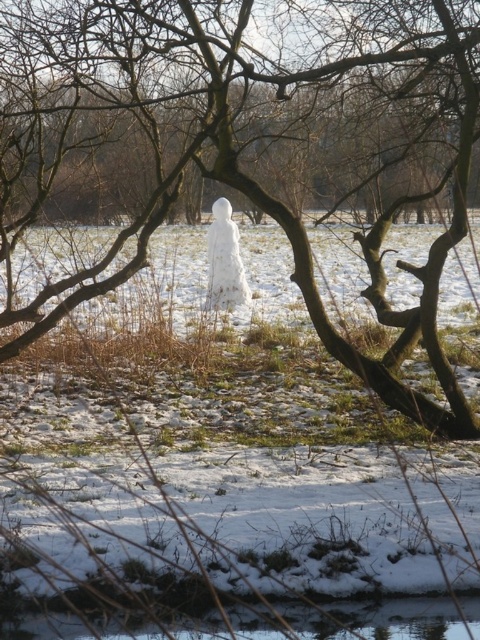
You are standing in the winter scene and see both the white snowman at center and the white fluffy snowman at center. Which one is positioned higher up in the image?

The white snowman at center is positioned higher up than the white fluffy snowman at center in the image.

You are a photographer trying to capture both the white snowman at center and the white fluffy snowman at center in one shot. Given their heights, which one would you need to adjust your camera angle to look up at?

The white snowman at center is taller than the white fluffy snowman at center, so you would need to adjust your camera angle to look up at the white snowman at center.

You are a delivery robot with a 3.5 meter wide package. You need to move from the left side of the image to the right side. Can you pass between the white snowman at center and the white fluffy snowman at center?

The distance between the white snowman at center and the white fluffy snowman at center is 4.11 meters. Since your package is 3.5 meters wide, you can pass between them as the distance is wider than the package.